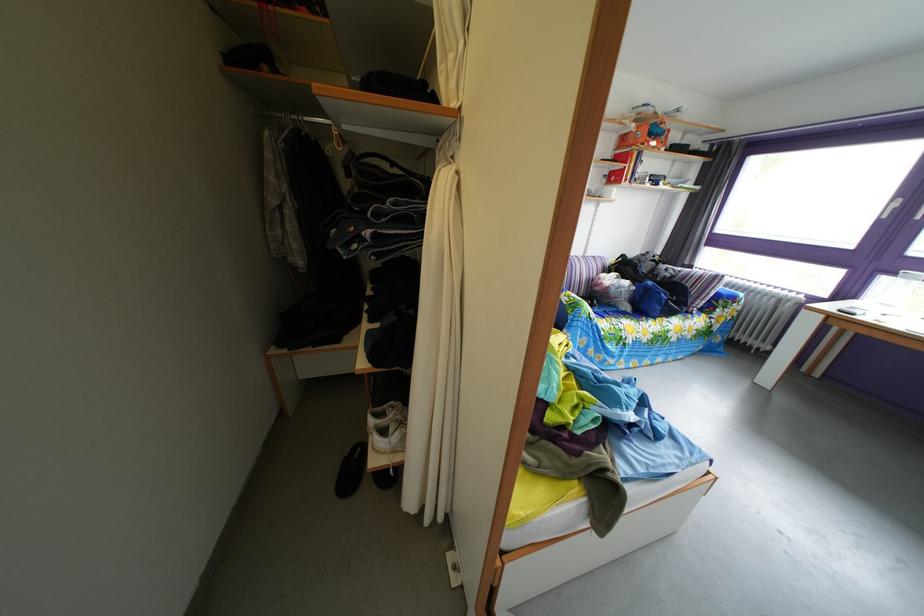
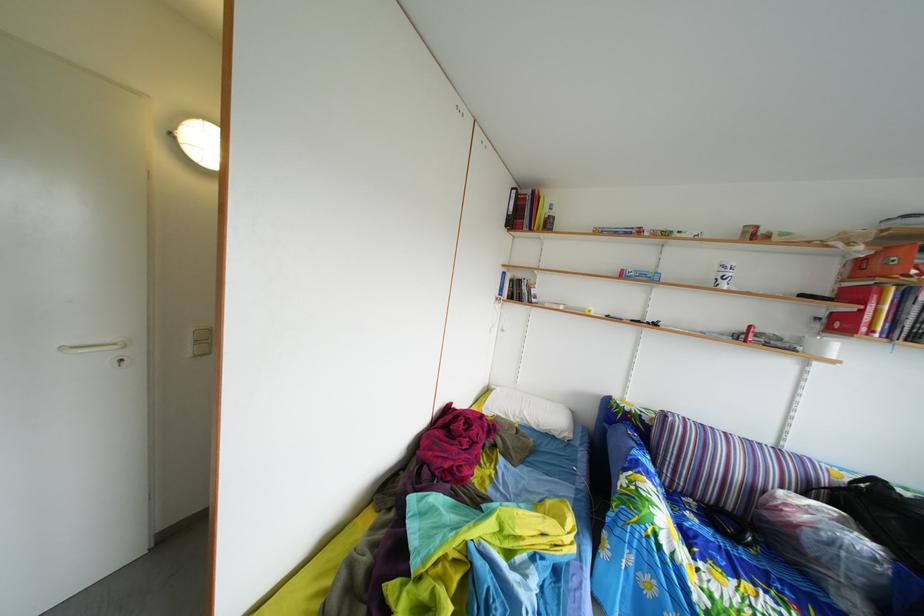
Question: The camera is either moving clockwise (left) or counter-clockwise (right) around the object. The first image is from the beginning of the video and the second image is from the end. Is the camera moving left or right when shooting the video?

Choices:
 (A) Left
 (B) Right

Answer: (B)